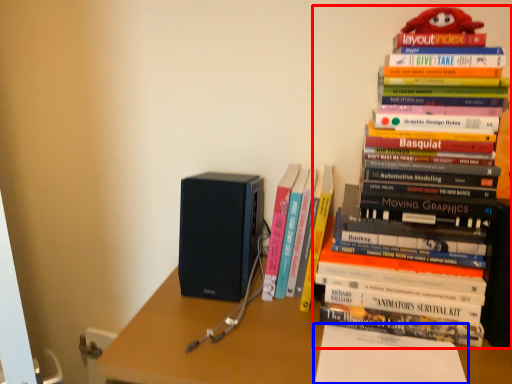
Question: Which of the following is the farthest to the observer, book (highlighted by a red box) or paperback book (highlighted by a blue box)?

Choices:
 (A) book
 (B) paperback book

Answer: (B)